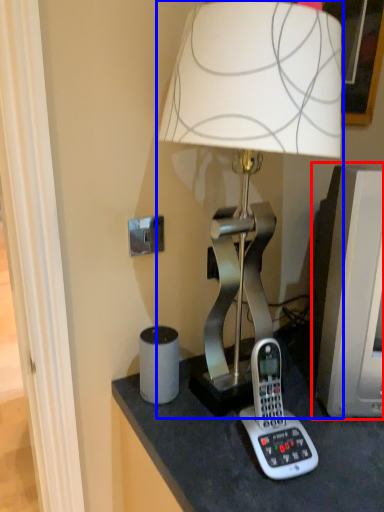
Question: Which object is closer to the camera taking this photo, computer monitor (highlighted by a red box) or lamp (highlighted by a blue box)?

Choices:
 (A) computer monitor
 (B) lamp

Answer: (B)